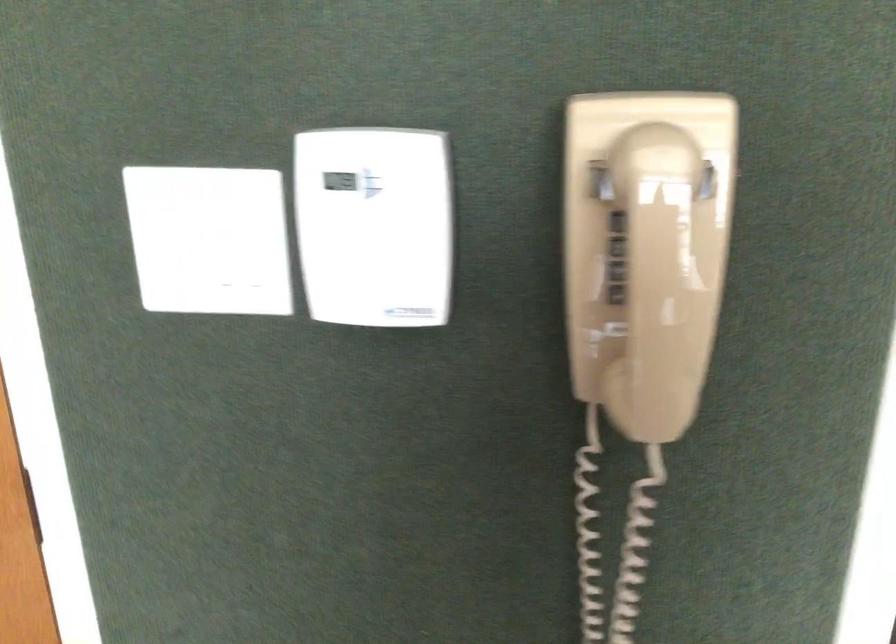
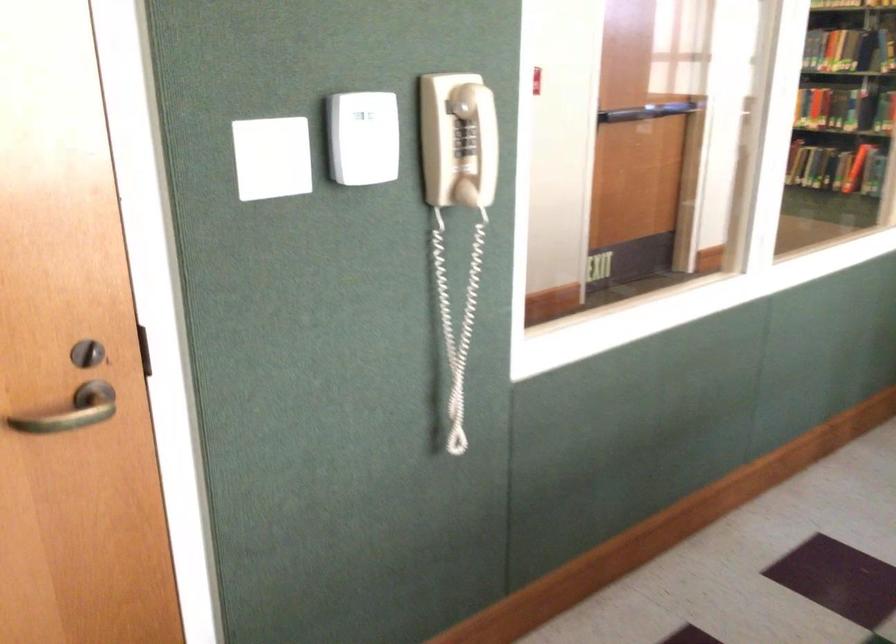
Question: Based on the continuous images, in which direction is the camera rotating? Reply with the corresponding letter.

Choices:
 (A) Left
 (B) Right
 (C) Up
 (D) Down

Answer: (B)